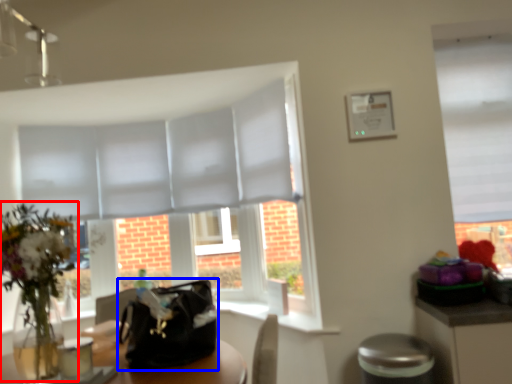
Question: Which point is closer to the camera, floral arrangement (highlighted by a red box) or handbag (highlighted by a blue box)?

Choices:
 (A) floral arrangement
 (B) handbag

Answer: (A)